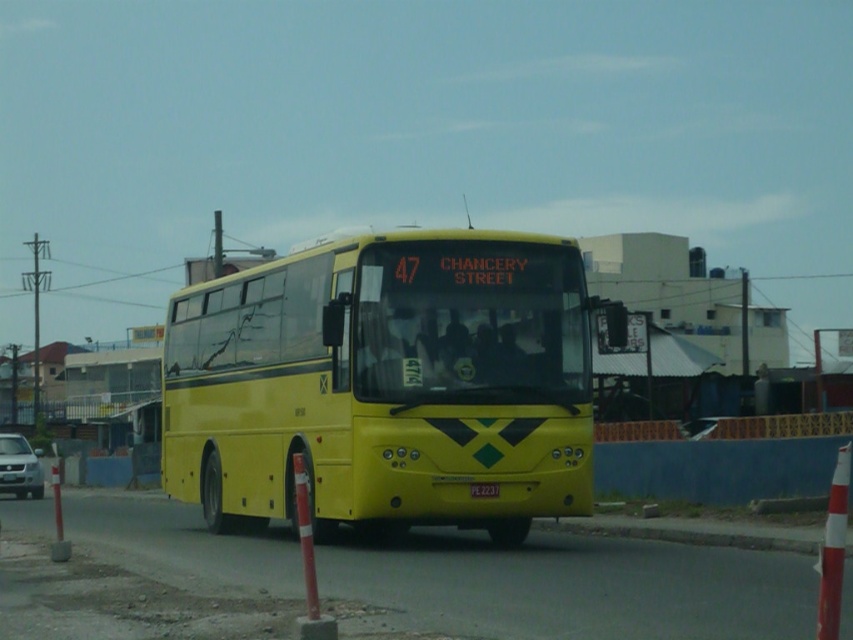
Between silver metallic car at lower left and black plastic license plate at center, which one has less height?

Standing shorter between the two is black plastic license plate at center.

Is point (33, 483) closer to viewer compared to point (490, 483)?

That is False.

Is point (0, 490) more distant than point (488, 488)?

Yes, it is behind point (488, 488).

Find the location of `silver metallic car at lower left`. silver metallic car at lower left is located at coordinates (19, 467).

Does yellow matte bus at center appear on the left side of black plastic license plate at center?

Yes, yellow matte bus at center is to the left of black plastic license plate at center.

Is yellow matte bus at center taller than black plastic license plate at center?

Correct, yellow matte bus at center is much taller as black plastic license plate at center.

In order to click on yellow matte bus at center in this screenshot , I will do `click(386, 385)`.

This screenshot has height=640, width=853. I want to click on yellow matte bus at center, so click(x=386, y=385).

Which is in front, point (401, 499) or point (30, 483)?

Point (401, 499)

Does point (553, 433) come behind point (0, 472)?

That is False.

Does point (453, 493) come farther from viewer compared to point (16, 492)?

No, (453, 493) is closer to viewer.

Where is `yellow matte bus at center`? yellow matte bus at center is located at coordinates (386, 385).